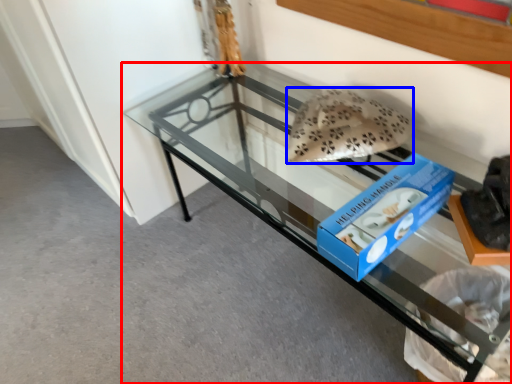
Question: Which of the following is the closest to the observer, furniture (highlighted by a red box) or stuff (highlighted by a blue box)?

Choices:
 (A) furniture
 (B) stuff

Answer: (A)